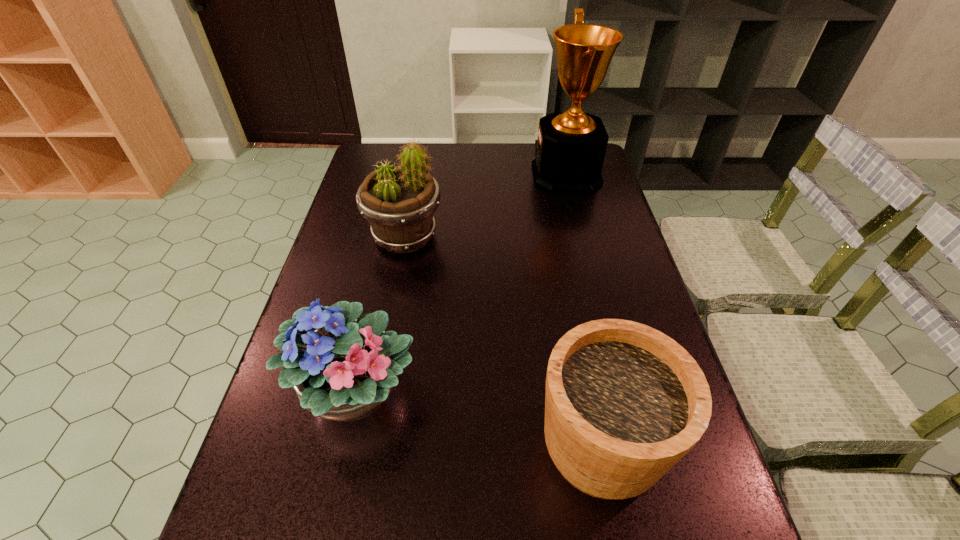
Where is `vacant point at the left edge`? Image resolution: width=960 pixels, height=540 pixels. vacant point at the left edge is located at coordinates (336, 246).

Where is `vacant space at the right edge`? The image size is (960, 540). vacant space at the right edge is located at coordinates (574, 229).

Where is `free point between the farther flowerpot and the right flowerpot`? The image size is (960, 540). free point between the farther flowerpot and the right flowerpot is located at coordinates (503, 341).

The width and height of the screenshot is (960, 540). Find the location of `blank region between the right flowerpot and the second farthest object`. blank region between the right flowerpot and the second farthest object is located at coordinates (503, 341).

In order to click on free area in between the trophy cup and the third shortest object in this screenshot , I will do `click(486, 206)`.

Find the location of a particular element. The image size is (960, 540). free point between the right flowerpot and the taller flowerpot is located at coordinates (503, 341).

You are a GUI agent. You are given a task and a screenshot of the screen. Output one action in this format:
    pyautogui.click(x=<x>, y=<y>)
    Task: Click on the empty space between the bouquet and the shorter flowerpot
    Image resolution: width=960 pixels, height=540 pixels.
    Given the screenshot: What is the action you would take?
    pyautogui.click(x=478, y=418)

In order to click on empty space that is in between the farther flowerpot and the farthest object in this screenshot , I will do `click(486, 206)`.

The height and width of the screenshot is (540, 960). I want to click on free space between the second tallest object and the nearer flowerpot, so click(x=503, y=341).

I want to click on empty space that is in between the farthest object and the left flowerpot, so click(x=486, y=206).